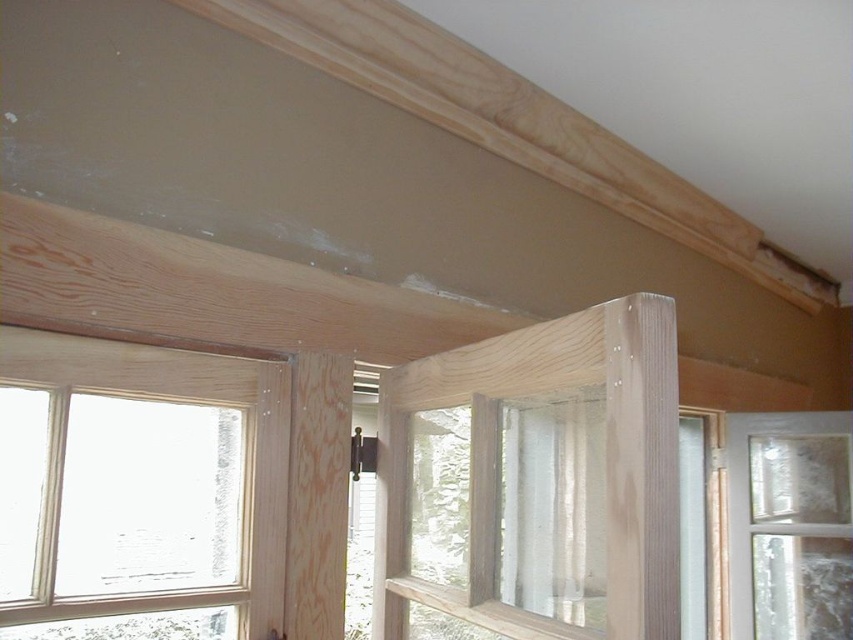
Does natural wood window frame at left have a lesser height compared to clear glass window at center?

Indeed, natural wood window frame at left has a lesser height compared to clear glass window at center.

Where is `natural wood window frame at left`? Image resolution: width=853 pixels, height=640 pixels. natural wood window frame at left is located at coordinates (138, 490).